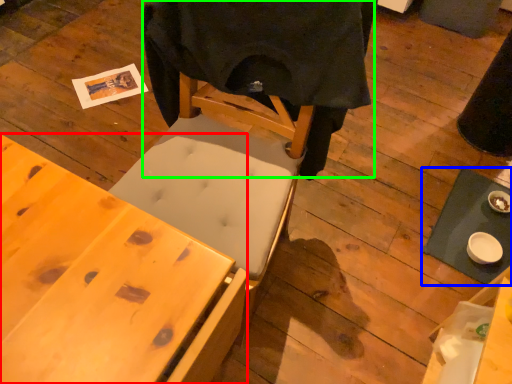
Question: Which object is positioned closest to desk (highlighted by a red box)? Select from table (highlighted by a blue box) and cloth (highlighted by a green box).

Choices:
 (A) table
 (B) cloth

Answer: (B)